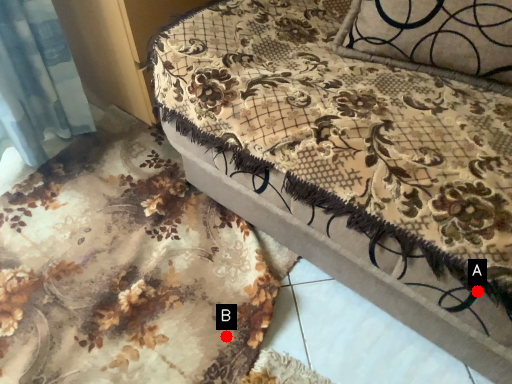
Question: Two points are circled on the image, labeled by A and B beside each circle. Among these points, which one is farthest from the camera?

Choices:
 (A) A is further
 (B) B is further

Answer: (B)